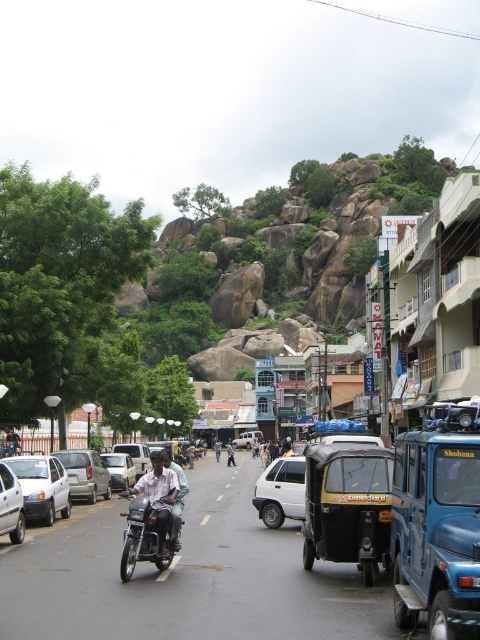
Locate an element on the screen. Image resolution: width=480 pixels, height=640 pixels. white matte car at lower left is located at coordinates (41, 486).

Does point (23, 481) lie behind point (130, 518)?

Yes, point (23, 481) is behind point (130, 518).

You are a GUI agent. You are given a task and a screenshot of the screen. Output one action in this format:
    pyautogui.click(x=<x>, y=<y>)
    Task: Click on the white matte car at lower left
    
    Given the screenshot: What is the action you would take?
    pyautogui.click(x=41, y=486)

Which is below, white matte car at left or silver metallic car at center?

Positioned lower is silver metallic car at center.

Can you confirm if white matte car at left is shorter than silver metallic car at center?

Incorrect, white matte car at left's height does not fall short of silver metallic car at center's.

Does point (4, 488) come behind point (120, 461)?

No, it is not.

You are a GUI agent. You are given a task and a screenshot of the screen. Output one action in this format:
    pyautogui.click(x=<x>, y=<y>)
    Task: Click on the white matte car at left
    The image size is (480, 640).
    Given the screenshot: What is the action you would take?
    pyautogui.click(x=11, y=506)

Which of these two, light brown leather jacket at center or black plastic motorcycle at center, stands shorter?

black plastic motorcycle at center

Is light brown leather jacket at center shorter than black plastic motorcycle at center?

In fact, light brown leather jacket at center may be taller than black plastic motorcycle at center.

Who is more distant from viewer, [165,532] or [142,509]?

Positioned behind is point [142,509].

This screenshot has height=640, width=480. I want to click on light brown leather jacket at center, so click(163, 499).